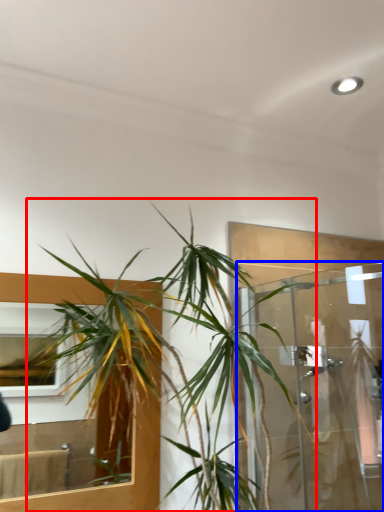
Question: Which point is further to the camera, houseplant (highlighted by a red box) or glass door (highlighted by a blue box)?

Choices:
 (A) houseplant
 (B) glass door

Answer: (B)